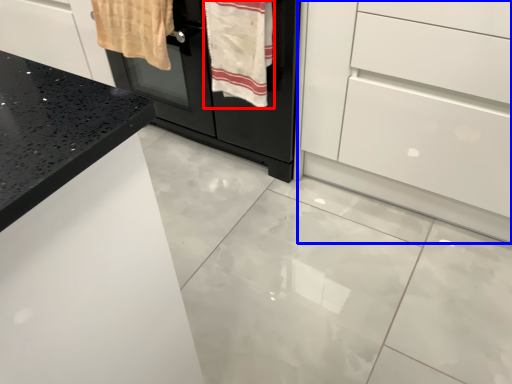
Question: Which of the following is the farthest to the observer, bath towel (highlighted by a red box) or chest of drawers (highlighted by a blue box)?

Choices:
 (A) bath towel
 (B) chest of drawers

Answer: (A)